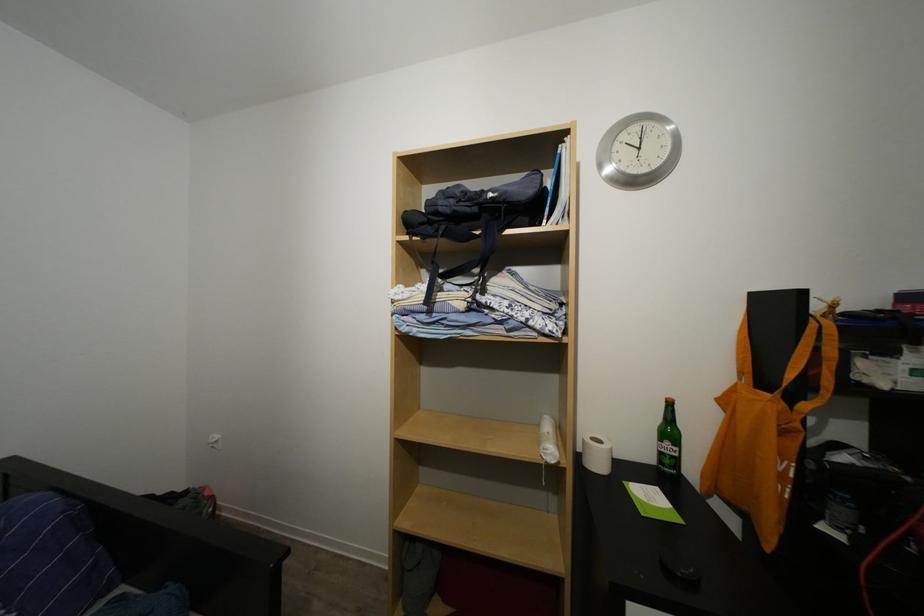
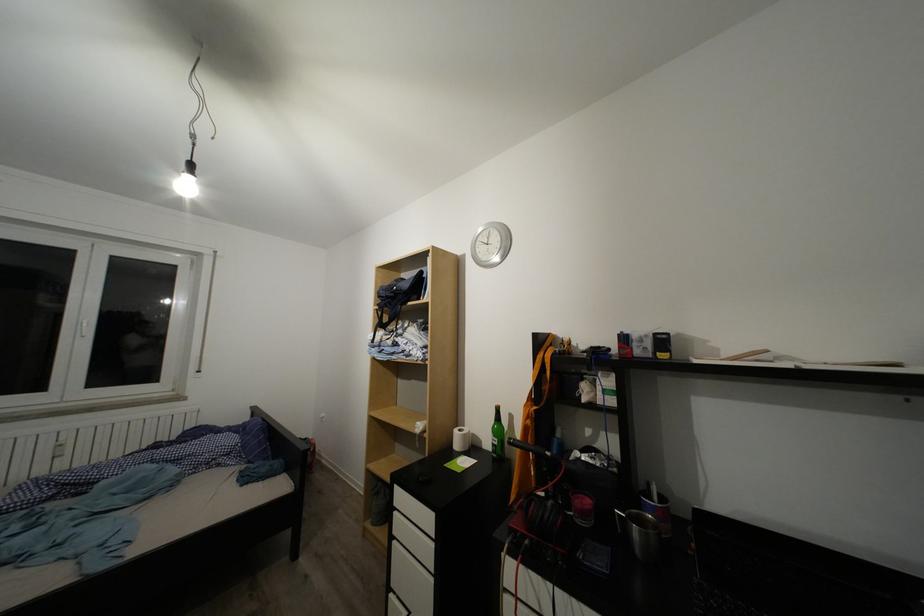
What movement of the cameraman would produce the second image?

The cameraman moved toward right, backward.